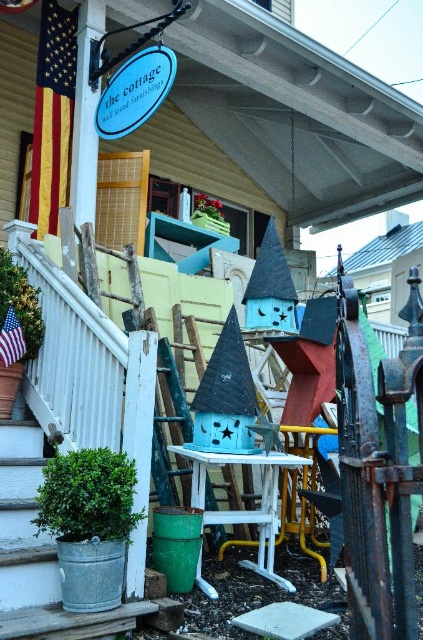
Between green galvanized bucket at lower left and american flag fabric at left, which one appears on the right side from the viewer's perspective?

From the viewer's perspective, green galvanized bucket at lower left appears more on the right side.

Is green galvanized bucket at lower left smaller than american flag fabric at left?

Incorrect, green galvanized bucket at lower left is not smaller in size than american flag fabric at left.

The image size is (423, 640). I want to click on green galvanized bucket at lower left, so click(38, 556).

Does matte blue birdhouse at center have a greater height compared to american flag fabric at left?

Correct, matte blue birdhouse at center is much taller as american flag fabric at left.

Who is more distant from viewer, (62, 280) or (18, 333)?

The point (18, 333) is more distant.

Is point (107, 362) behind point (8, 337)?

No, (107, 362) is closer to viewer.

In order to click on matte blue birdhouse at center in this screenshot , I will do `click(82, 364)`.

Does matte blue birdhouse at center lie behind green galvanized bucket at lower left?

That is True.

Measure the distance between matte blue birdhouse at center and camera.

2.52 meters

What do you see at coordinates (82, 364) in the screenshot?
I see `matte blue birdhouse at center` at bounding box center [82, 364].

Where is `matte blue birdhouse at center`? matte blue birdhouse at center is located at coordinates (82, 364).